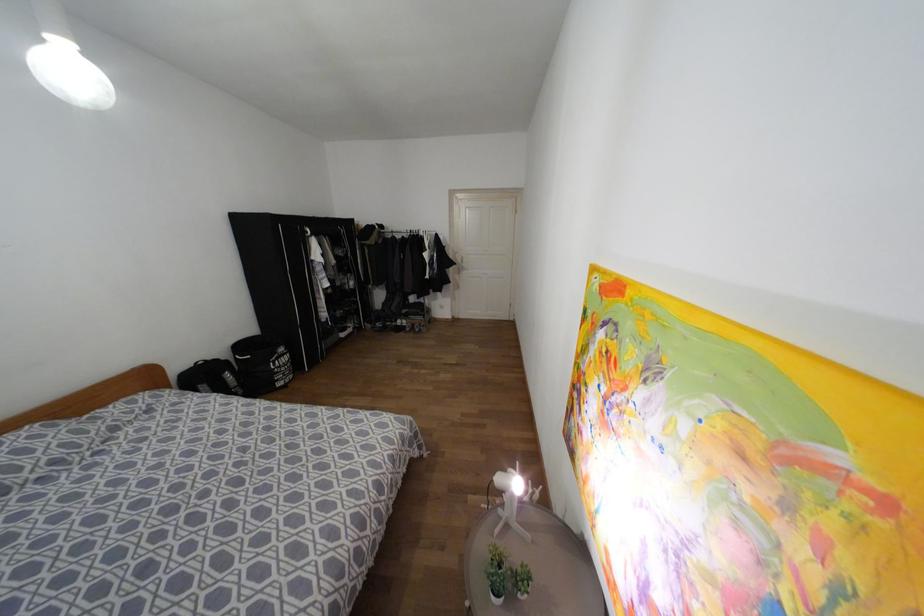
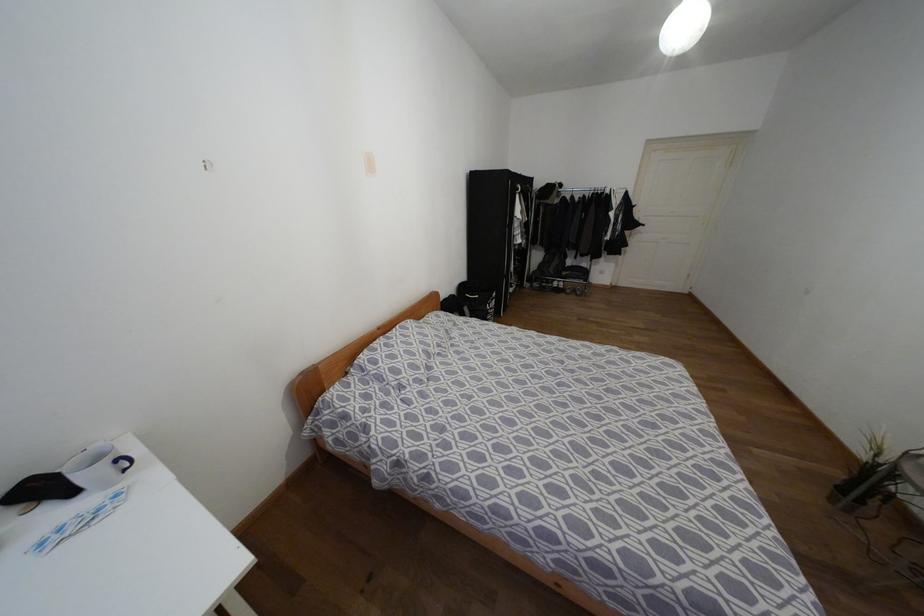
Locate, in the second image, the point that corresponds to the point at 281,349 in the first image.

(493, 294)